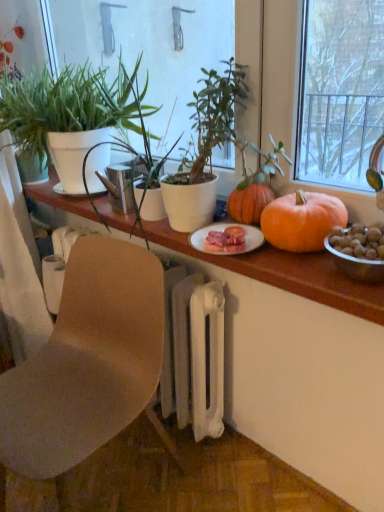
Question: Can you confirm if green matte plant at left, acting as the 1th houseplant starting from the left, is smaller than green matte plant at center, the 2th houseplant in the left-to-right sequence?

Choices:
 (A) no
 (B) yes

Answer: (A)

Question: From the image's perspective, is green matte plant at left, positioned as the 2th houseplant in right-to-left order, on green matte plant at center, the 2th houseplant in the left-to-right sequence?

Choices:
 (A) yes
 (B) no

Answer: (A)

Question: Is green matte plant at left, positioned as the 2th houseplant in right-to-left order, shorter than green matte plant at center, the 2th houseplant in the left-to-right sequence?

Choices:
 (A) no
 (B) yes

Answer: (A)

Question: Is green matte plant at center, the 2th houseplant in the left-to-right sequence, completely or partially inside green matte plant at left, acting as the 1th houseplant starting from the left?

Choices:
 (A) yes
 (B) no

Answer: (B)

Question: Can you confirm if green matte plant at left, acting as the 1th houseplant starting from the left, is taller than green matte plant at center, which is counted as the 1th houseplant, starting from the right?

Choices:
 (A) no
 (B) yes

Answer: (B)

Question: Considering the positions of orange matte pumpkin at center and wooden table at center in the image, is orange matte pumpkin at center wider or thinner than wooden table at center?

Choices:
 (A) wide
 (B) thin

Answer: (B)

Question: Is orange matte pumpkin at center taller or shorter than wooden table at center?

Choices:
 (A) tall
 (B) short

Answer: (A)

Question: From the image's perspective, is orange matte pumpkin at center above or below wooden table at center?

Choices:
 (A) below
 (B) above

Answer: (A)

Question: Is orange matte pumpkin at center situated inside wooden table at center or outside?

Choices:
 (A) outside
 (B) inside

Answer: (A)

Question: From the image's perspective, relative to orange matte pumpkin at center, is brown matte chair at lower left above or below?

Choices:
 (A) below
 (B) above

Answer: (A)

Question: In terms of width, does brown matte chair at lower left look wider or thinner when compared to orange matte pumpkin at center?

Choices:
 (A) thin
 (B) wide

Answer: (B)

Question: In terms of height, does brown matte chair at lower left look taller or shorter compared to orange matte pumpkin at center?

Choices:
 (A) short
 (B) tall

Answer: (B)

Question: In terms of size, does brown matte chair at lower left appear bigger or smaller than orange matte pumpkin at center?

Choices:
 (A) big
 (B) small

Answer: (A)

Question: Considering the positions of green matte plant at center, the 2th houseplant in the left-to-right sequence, and wooden table at center in the image, is green matte plant at center, the 2th houseplant in the left-to-right sequence, bigger or smaller than wooden table at center?

Choices:
 (A) small
 (B) big

Answer: (A)

Question: From the image's perspective, is green matte plant at center, the 2th houseplant in the left-to-right sequence, located above or below wooden table at center?

Choices:
 (A) above
 (B) below

Answer: (A)